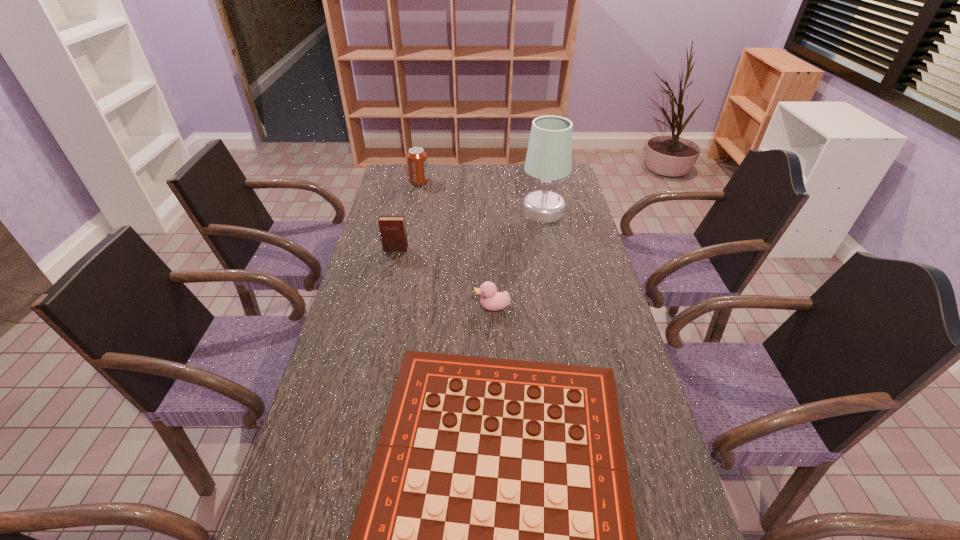
The image size is (960, 540). I want to click on free space that is in between the third farthest object and the farthest object, so click(x=407, y=215).

Locate an element on the screen. The image size is (960, 540). empty space that is in between the tallest object and the can is located at coordinates (481, 196).

Where is `unoccupied position between the third farthest object and the fourth farthest object`? unoccupied position between the third farthest object and the fourth farthest object is located at coordinates (444, 278).

Find the location of a particular element. empty location between the third nearest object and the farthest object is located at coordinates (407, 215).

Identify the location of free spot between the farthest object and the third nearest object. (407, 215).

Find the location of a particular element. This screenshot has width=960, height=540. free point between the diary and the can is located at coordinates (407, 215).

Identify the location of vacant area that lies between the third farthest object and the fourth tallest object. (444, 278).

Locate which object is the fourth closest to the fourth nearest object. Please provide its 2D coordinates. Your answer should be formatted as a tuple, i.e. [(x, y)], where the tuple contains the x and y coordinates of a point satisfying the conditions above.

[(495, 539)]

Identify the location of object that stands as the third closest to the fourth farthest object. The image size is (960, 540). (549, 154).

Locate an element on the screen. free space that satisfies the following two spatial constraints: 1. on the base of the tallest object; 2. on the front-facing side of the second nearest object is located at coordinates (563, 307).